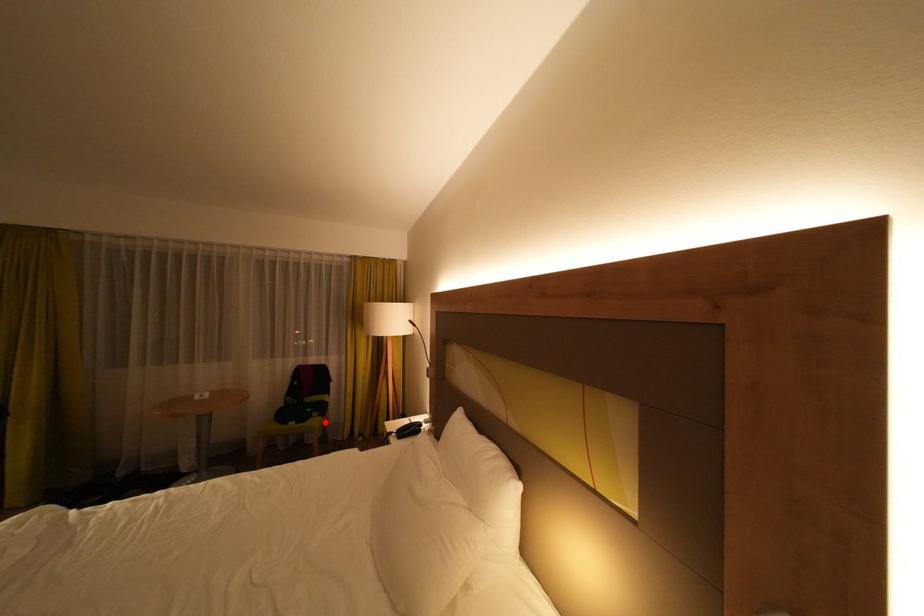
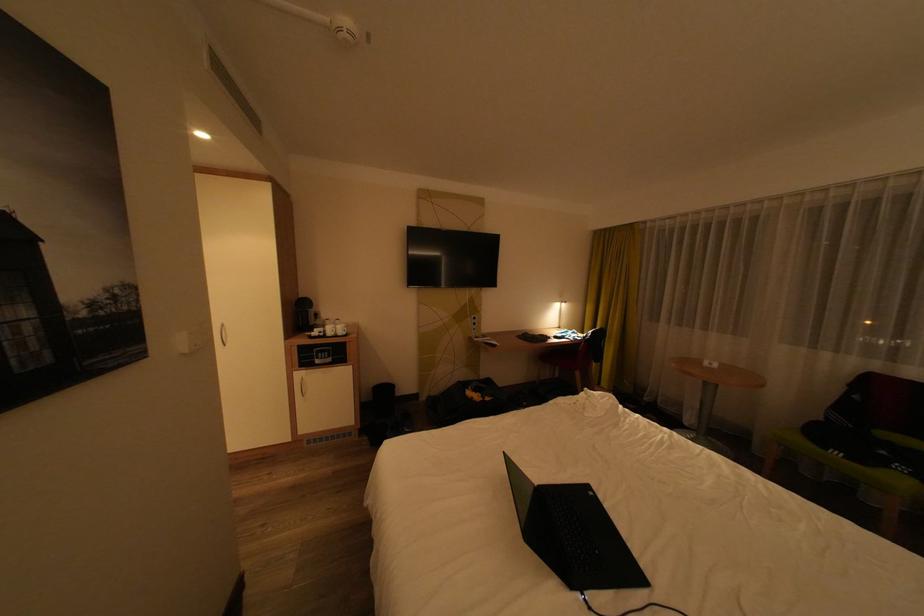
Question: I am providing you with two images of the same scene from different viewpoints. Image1 has a red point marked. In image2, the corresponding 3D location appears at what relative position? Reply with the corresponding letter.

Choices:
 (A) Closer
 (B) Farther

Answer: (A)